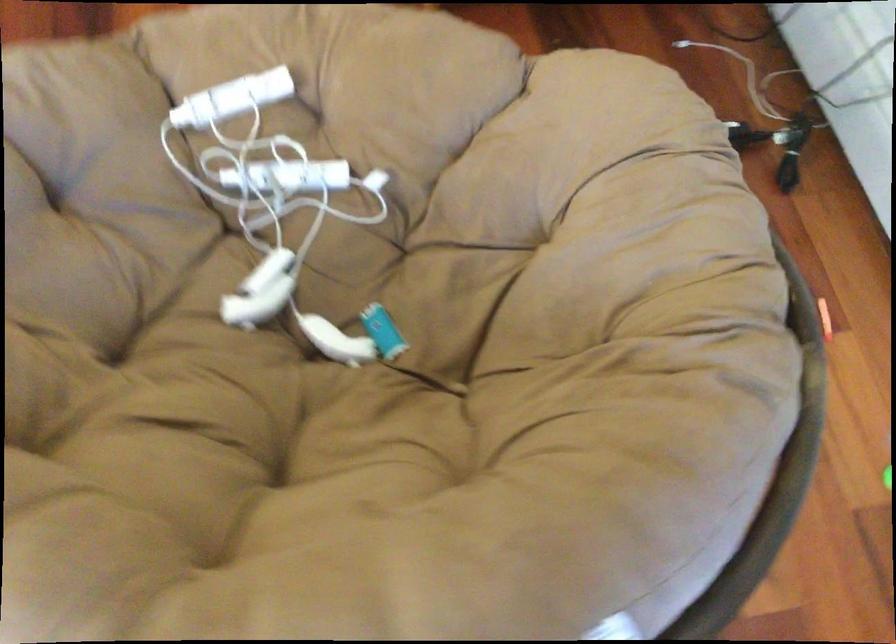
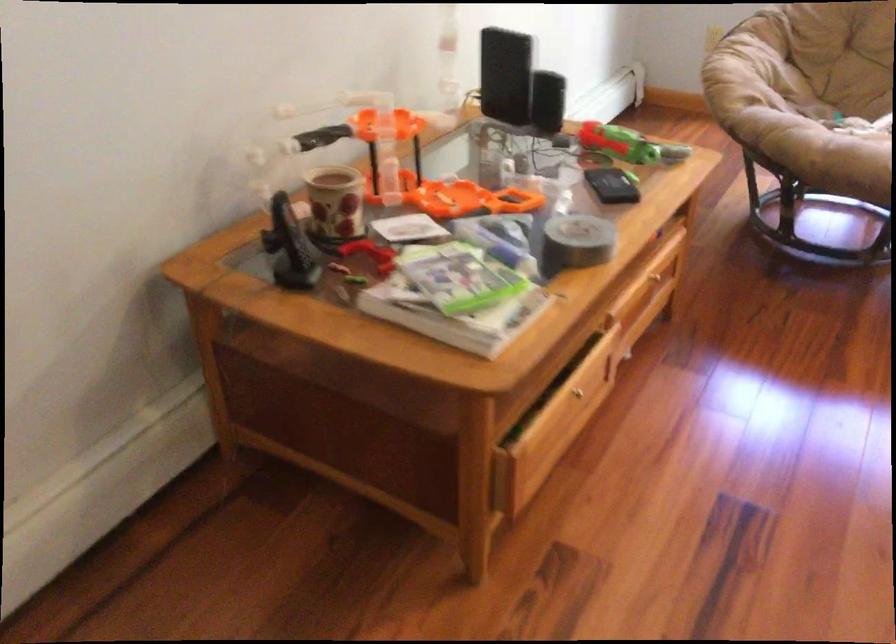
Locate, in the second image, the point that corresponds to [571,140] in the first image.

(745, 69)